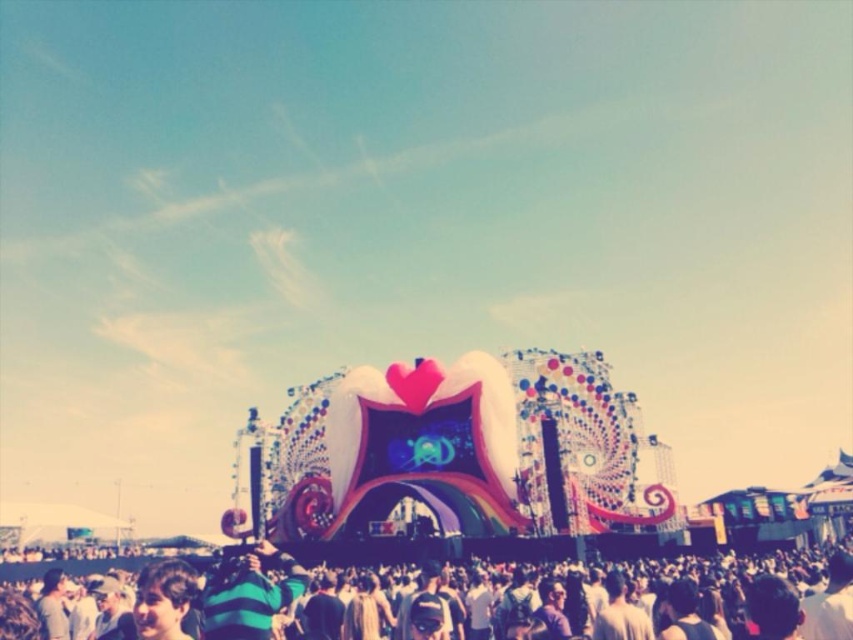
Image resolution: width=853 pixels, height=640 pixels. What do you see at coordinates (450, 456) in the screenshot?
I see `shiny metallic heart at center` at bounding box center [450, 456].

I want to click on shiny metallic heart at center, so click(x=450, y=456).